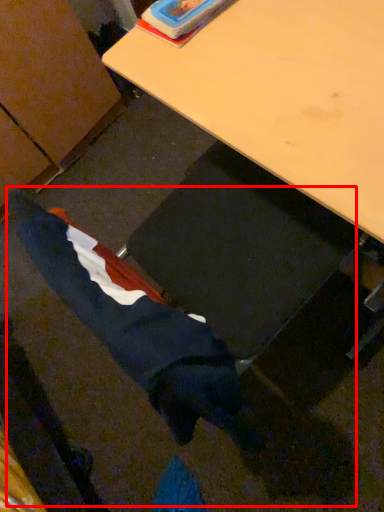
Question: From the image's perspective, where is woman (annotated by the red box) located in relation to desk in the image?

Choices:
 (A) above
 (B) below

Answer: (B)